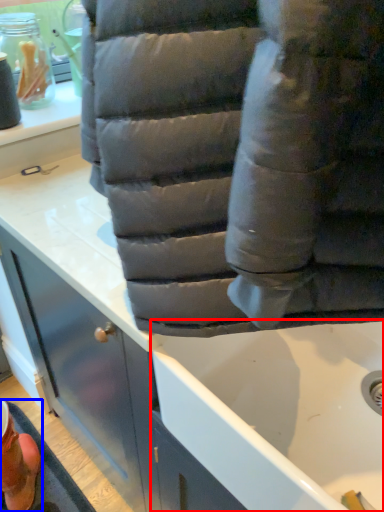
Question: Which of the following is the closest to the observer, bath (highlighted by a red box) or footwear (highlighted by a blue box)?

Choices:
 (A) bath
 (B) footwear

Answer: (A)